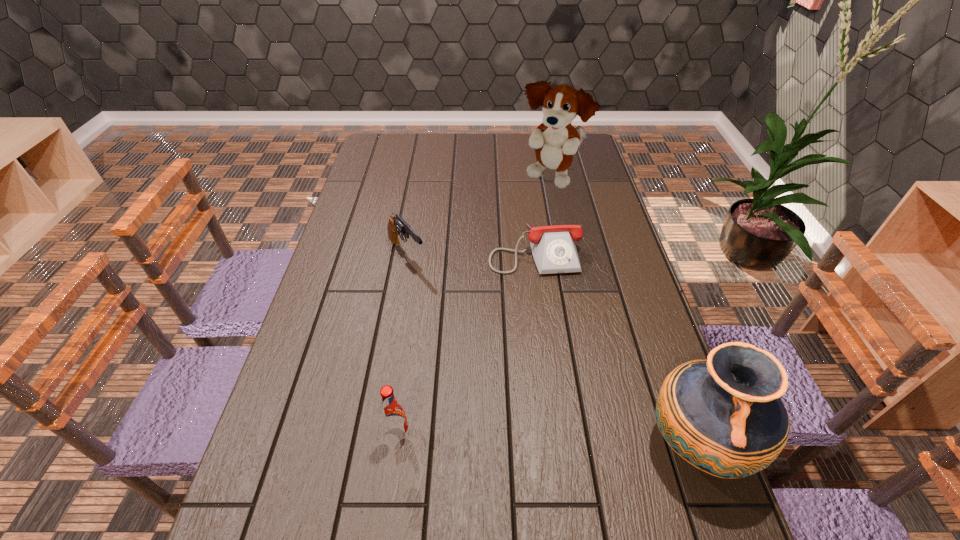
This screenshot has width=960, height=540. Find the location of `free space between the second shortest object and the farthest object`. free space between the second shortest object and the farthest object is located at coordinates (479, 217).

At what (x,y) coordinates should I click in order to perform the action: click on free space between the farthest object and the fourth shortest object. Please return your answer as a coordinate pair (x, y). Looking at the image, I should click on (623, 312).

Image resolution: width=960 pixels, height=540 pixels. Identify the location of unoccupied position between the root beer and the shortest object. (467, 342).

You are a GUI agent. You are given a task and a screenshot of the screen. Output one action in this format:
    pyautogui.click(x=<x>, y=<y>)
    Task: Click on the vacant space that is in between the shortest object and the second tallest object
    The image size is (960, 540).
    Given the screenshot: What is the action you would take?
    pyautogui.click(x=614, y=347)

Image resolution: width=960 pixels, height=540 pixels. I want to click on free space between the pottery and the fourth tallest object, so click(x=551, y=349).

Image resolution: width=960 pixels, height=540 pixels. Identify the location of free spot between the root beer and the pottery. pos(547,440).

Image resolution: width=960 pixels, height=540 pixels. Identify the location of blank region between the root beer and the puppy. (474, 307).

Where is `free area in between the telephone and the root beer`? This screenshot has width=960, height=540. free area in between the telephone and the root beer is located at coordinates (467, 342).

Locate an element on the screen. blank region between the third tallest object and the telephone is located at coordinates (467, 342).

Choose which object is the third nearest neighbor to the fourth shortest object. Please provide its 2D coordinates. Your answer should be formatted as a tuple, i.e. [(x, y)], where the tuple contains the x and y coordinates of a point satisfying the conditions above.

[(396, 225)]